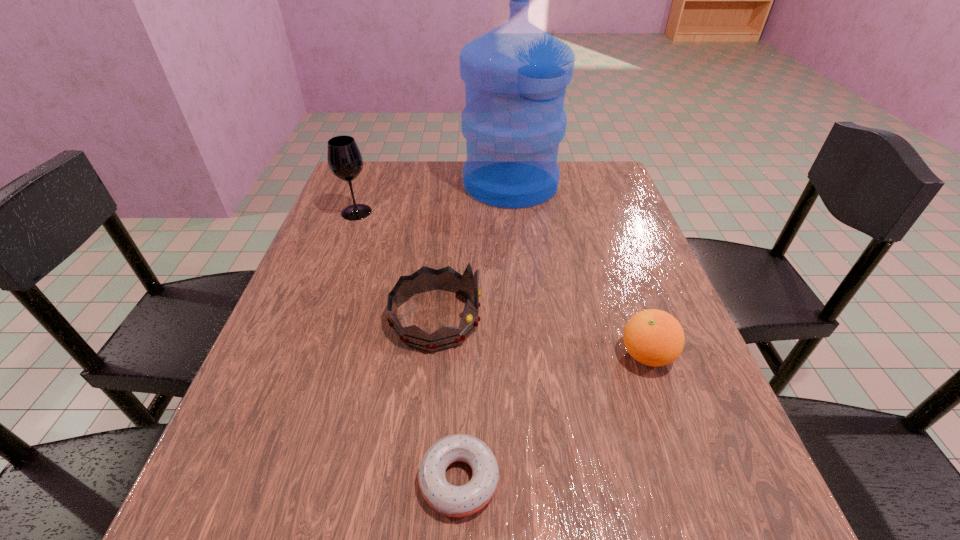
Image resolution: width=960 pixels, height=540 pixels. Identify the location of vacant space located at the front of the third shortest object with jewels. (506, 318).

Find the location of `vacant area located 0.110m on the front of the second shortest object`. vacant area located 0.110m on the front of the second shortest object is located at coordinates (675, 436).

At what (x,y) coordinates should I click in order to perform the action: click on vacant area located 0.250m on the right of the nearest object. Please return your answer as a coordinate pair (x, y). Looking at the image, I should click on (668, 480).

This screenshot has width=960, height=540. I want to click on object at the far edge, so click(515, 75).

Where is `object present at the near edge`? object present at the near edge is located at coordinates (454, 501).

I want to click on object that is at the left edge, so click(x=345, y=161).

The width and height of the screenshot is (960, 540). I want to click on object located in the right edge section of the desktop, so [x=653, y=337].

Where is `free space at the left edge of the desktop`? free space at the left edge of the desktop is located at coordinates (246, 466).

Where is `free spot at the right edge of the desktop`? The height and width of the screenshot is (540, 960). free spot at the right edge of the desktop is located at coordinates (699, 399).

This screenshot has width=960, height=540. Identify the location of vacant space at the near left corner of the desktop. (194, 508).